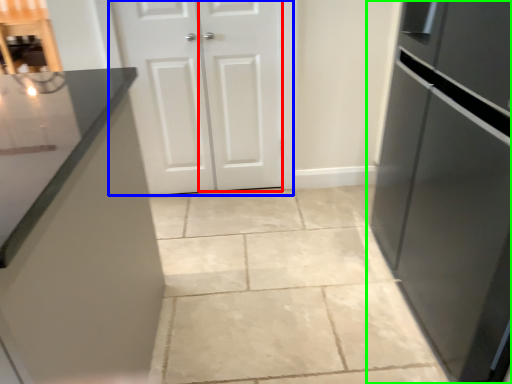
Question: Which object is the farthest from door (highlighted by a red box)? Choose among these: door (highlighted by a blue box) or refrigerator (highlighted by a green box).

Choices:
 (A) door
 (B) refrigerator

Answer: (B)